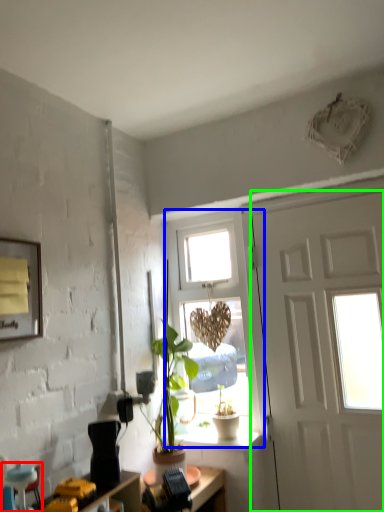
Question: Which object is positioned closest to armchair (highlighted by a red box)? Select from window (highlighted by a blue box) and door (highlighted by a green box).

Choices:
 (A) window
 (B) door

Answer: (A)